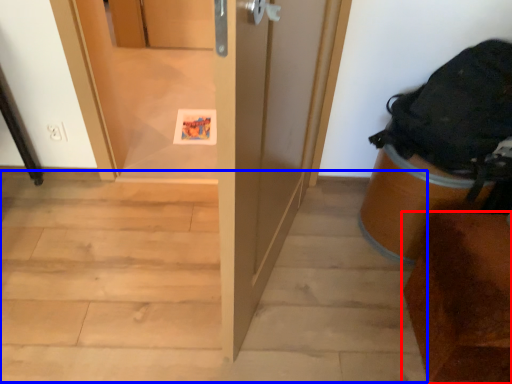
Question: Which point is further to the camera, furniture (highlighted by a red box) or stairwell (highlighted by a blue box)?

Choices:
 (A) furniture
 (B) stairwell

Answer: (B)